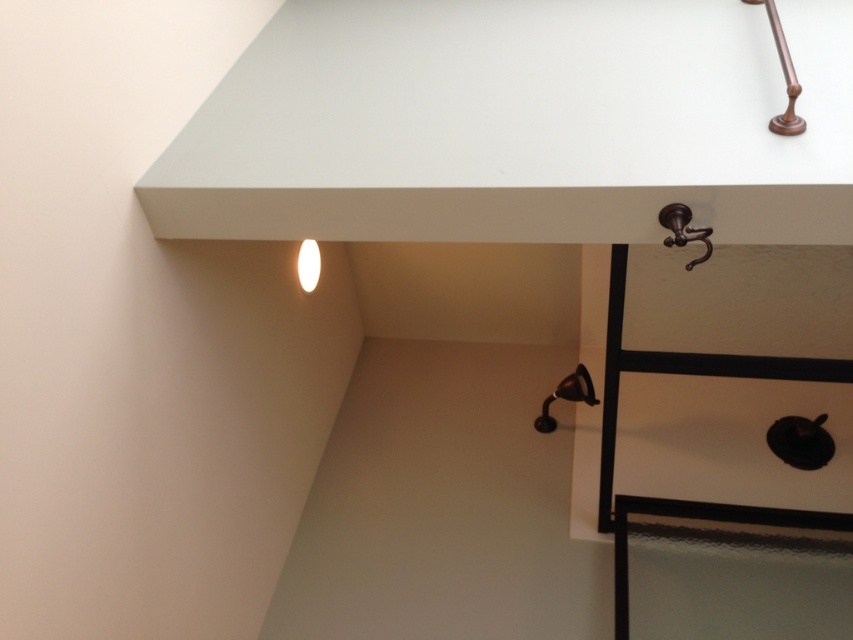
You are standing in front of the desk and want to place a small object on the desk surface. If you have to choose between placing it at point [776,13] or point [567,396], which point is closer to you?

Point [776,13] is closer to the viewer than point [567,396], so you should place the object there if you want it nearer to your current position.

You are organizing items on your desk and need to place a new pen holder. The desk has a copper polished faucet at upper right located at point (782, 76). Where should you place the pen holder to avoid blocking the faucet?

Place the pen holder away from the copper polished faucet at upper right located at point (782, 76) to avoid blocking it.